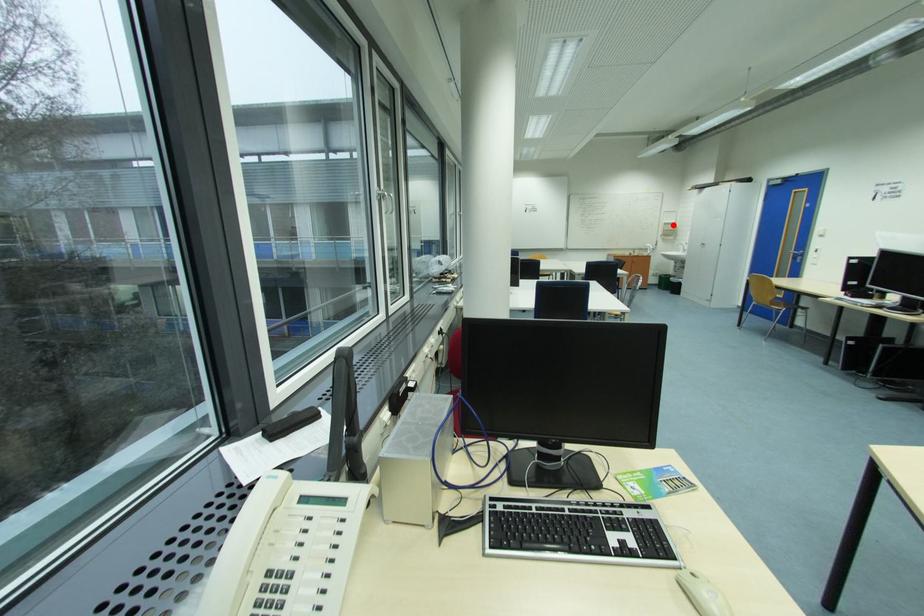
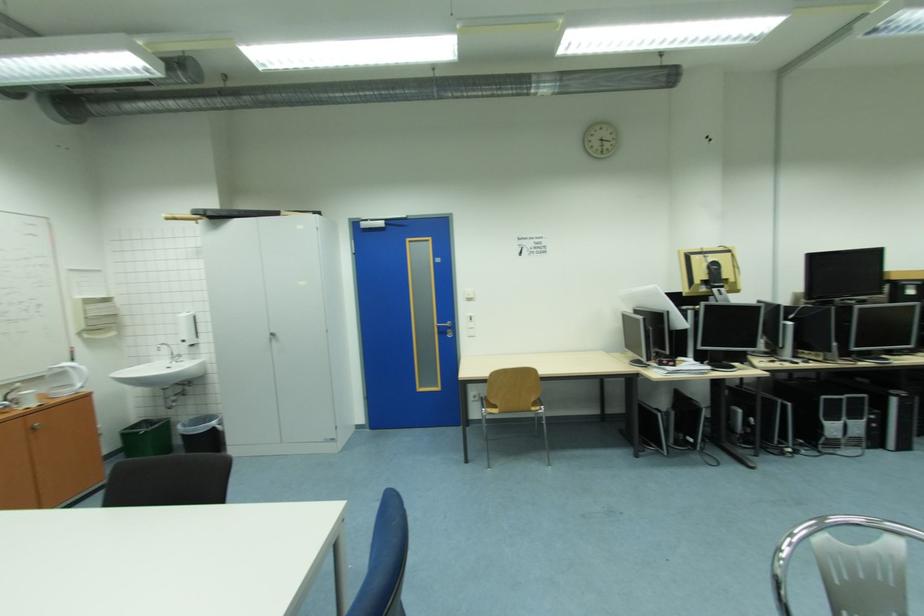
Where in the second image is the point corresponding to the highlighted location from the first image?

(94, 302)